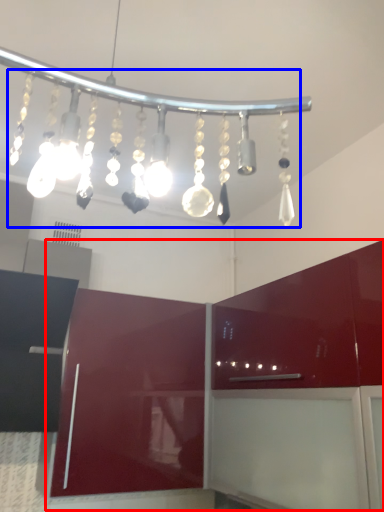
Question: Which of the following is the closest to the observer, cabinetry (highlighted by a red box) or chandelier (highlighted by a blue box)?

Choices:
 (A) cabinetry
 (B) chandelier

Answer: (B)